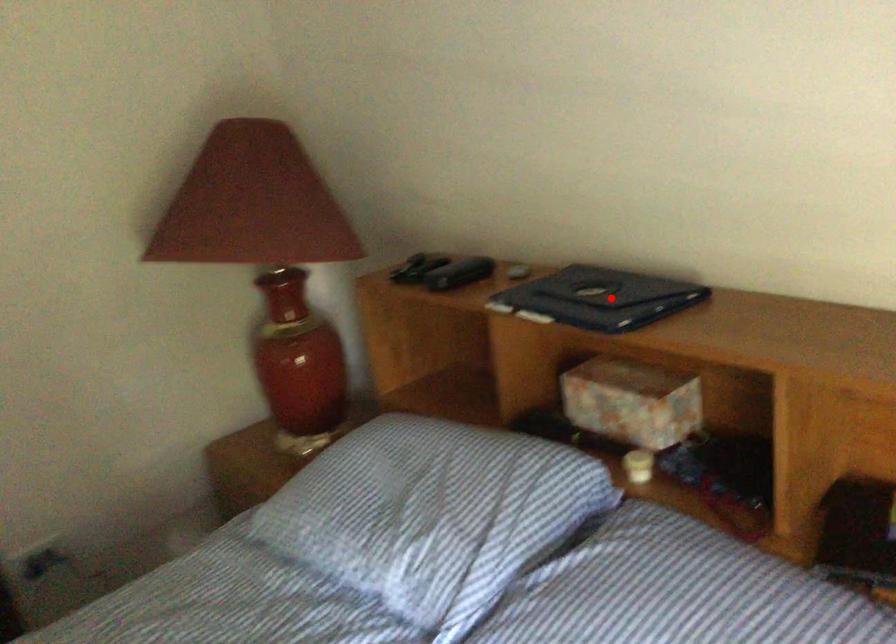
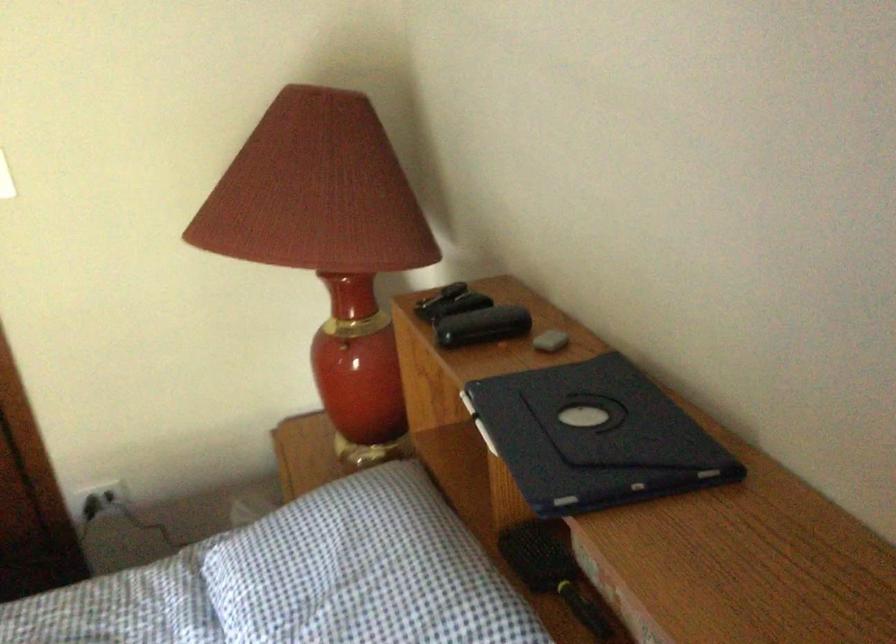
Question: I am providing you with two images of the same scene from different viewpoints. Given a red point in image1, look at the same physical point in image2. Is it:

Choices:
 (A) Closer to the viewpoint
 (B) Farther from the viewpoint

Answer: (A)